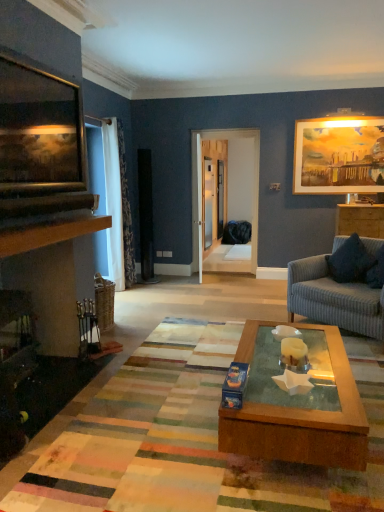
Question: From the image's perspective, would you say white floral fabric curtain at left is positioned over multicolored woven mat at center?

Choices:
 (A) no
 (B) yes

Answer: (B)

Question: Is the depth of white floral fabric curtain at left less than that of multicolored woven mat at center?

Choices:
 (A) yes
 (B) no

Answer: (B)

Question: Can multicolored woven mat at center be found inside white floral fabric curtain at left?

Choices:
 (A) no
 (B) yes

Answer: (A)

Question: From a real-world perspective, is white floral fabric curtain at left physically below multicolored woven mat at center?

Choices:
 (A) no
 (B) yes

Answer: (A)

Question: From a real-world perspective, does white floral fabric curtain at left stand above multicolored woven mat at center?

Choices:
 (A) yes
 (B) no

Answer: (A)

Question: From a real-world perspective, is matte wooden picture frame at upper right, marked as the first picture frame in a back-to-front arrangement, positioned above or below wooden picture frame at upper left, the 2th picture frame when ordered from back to front?

Choices:
 (A) below
 (B) above

Answer: (A)

Question: Considering the positions of matte wooden picture frame at upper right, the 2th picture frame from the left, and wooden picture frame at upper left, the first picture frame in the front-to-back sequence, in the image, is matte wooden picture frame at upper right, the 2th picture frame from the left, bigger or smaller than wooden picture frame at upper left, the first picture frame in the front-to-back sequence,?

Choices:
 (A) big
 (B) small

Answer: (B)

Question: Is matte wooden picture frame at upper right, which ranks as the second picture frame in front-to-back order, in front of or behind wooden picture frame at upper left, the first picture frame in the front-to-back sequence, in the image?

Choices:
 (A) front
 (B) behind

Answer: (B)

Question: From the image's perspective, is matte wooden picture frame at upper right, which appears as the 1th picture frame when viewed from the right, above or below wooden picture frame at upper left, the first picture frame in the front-to-back sequence?

Choices:
 (A) below
 (B) above

Answer: (B)

Question: Does point (349, 116) appear closer or farther from the camera than point (107, 200)?

Choices:
 (A) closer
 (B) farther

Answer: (B)

Question: Considering the positions of matte wooden picture frame at upper right, the 2th picture frame from the left, and white floral fabric curtain at left in the image, is matte wooden picture frame at upper right, the 2th picture frame from the left, bigger or smaller than white floral fabric curtain at left?

Choices:
 (A) small
 (B) big

Answer: (A)

Question: Is matte wooden picture frame at upper right, which ranks as the second picture frame in front-to-back order, to the left or to the right of white floral fabric curtain at left in the image?

Choices:
 (A) left
 (B) right

Answer: (B)

Question: Is matte wooden picture frame at upper right, marked as the first picture frame in a back-to-front arrangement, spatially inside white floral fabric curtain at left, or outside of it?

Choices:
 (A) outside
 (B) inside

Answer: (A)

Question: Is point (115, 265) positioned closer to the camera than point (342, 232)?

Choices:
 (A) farther
 (B) closer

Answer: (A)

Question: Would you say white floral fabric curtain at left is to the left or to the right of wooden cabinet at right in the picture?

Choices:
 (A) left
 (B) right

Answer: (A)